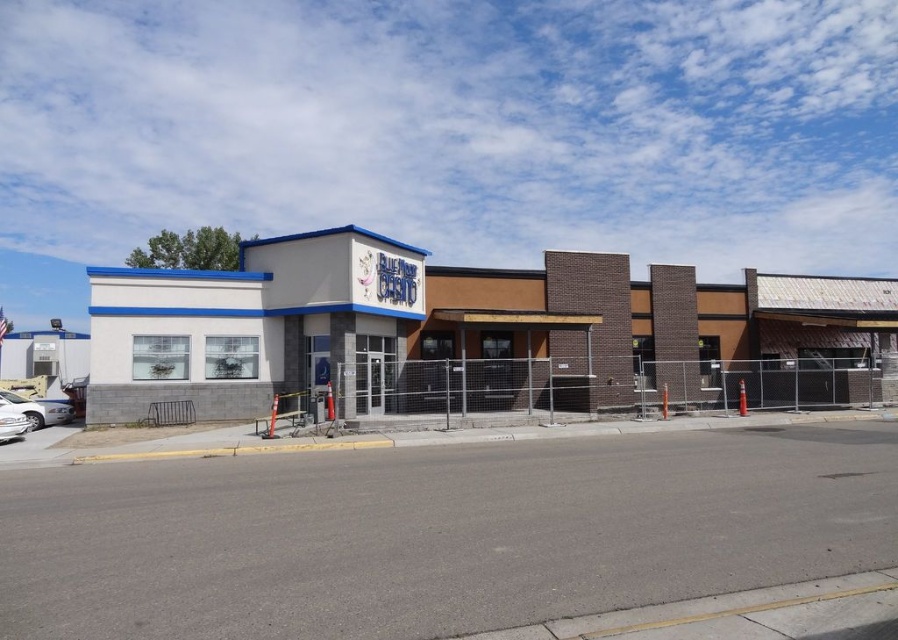
Measure the distance between white brick building at left and silver metallic car at lower left.

The distance of white brick building at left from silver metallic car at lower left is 45.44 feet.

Who is more distant from viewer, (386, 237) or (2, 419)?

The point (386, 237) is behind.

Where is `white brick building at left`? Image resolution: width=898 pixels, height=640 pixels. white brick building at left is located at coordinates pyautogui.click(x=474, y=333).

Is white glossy car at lower left to the left of silver metallic car at lower left from the viewer's perspective?

Indeed, white glossy car at lower left is positioned on the left side of silver metallic car at lower left.

Between white glossy car at lower left and silver metallic car at lower left, which one appears on the left side from the viewer's perspective?

From the viewer's perspective, white glossy car at lower left appears more on the left side.

Does point (7, 403) lie behind point (7, 433)?

That is True.

Locate an element on the screen. This screenshot has width=898, height=640. white glossy car at lower left is located at coordinates (36, 410).

Consider the image. Between white brick building at left and white glossy car at lower left, which one appears on the left side from the viewer's perspective?

white glossy car at lower left is more to the left.

How much distance is there between white brick building at left and white glossy car at lower left?

white brick building at left is 14.01 meters away from white glossy car at lower left.

Between point (492, 284) and point (40, 412), which one is positioned behind?

Point (492, 284)

Image resolution: width=898 pixels, height=640 pixels. Identify the location of white brick building at left. click(474, 333).